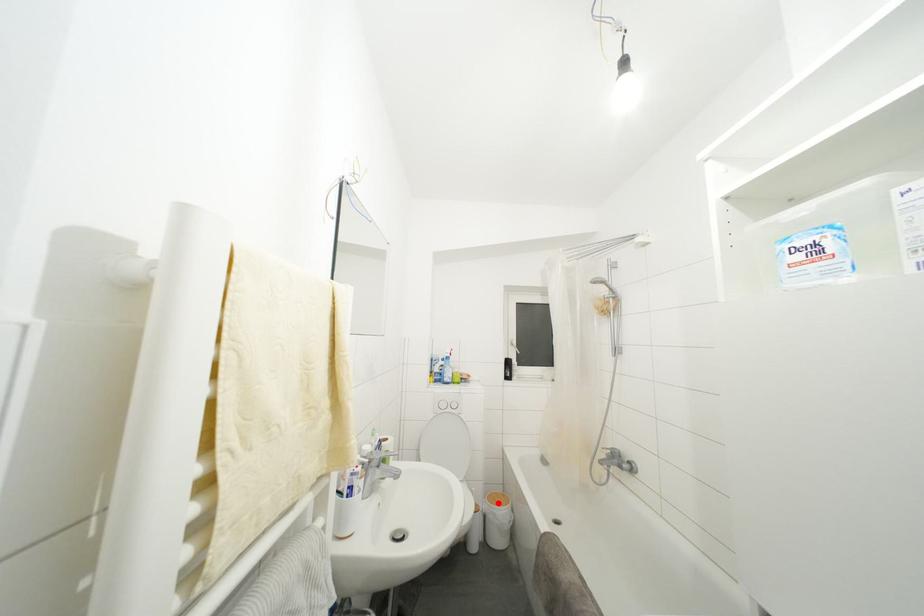
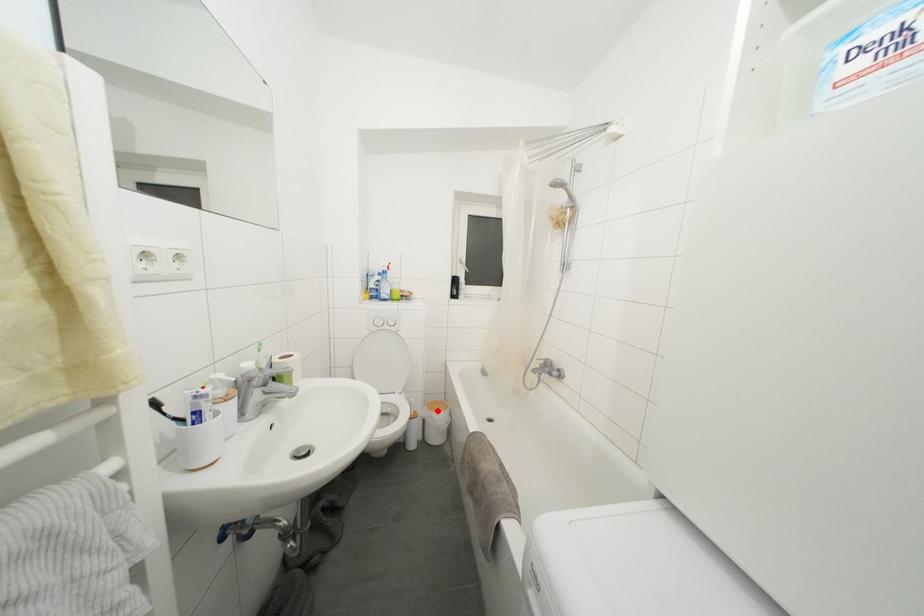
I am providing you with two images of the same scene from different viewpoints. A red point is marked on the first image and another point is marked on the second image. Does the point marked in image1 correspond to the same location as the one in image2?

Yes